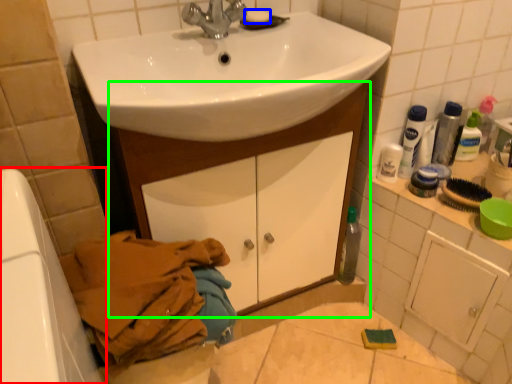
Question: Which is farther away from bath (highlighted by a red box)? soap (highlighted by a blue box) or bathroom cabinet (highlighted by a green box)?

Choices:
 (A) soap
 (B) bathroom cabinet

Answer: (A)